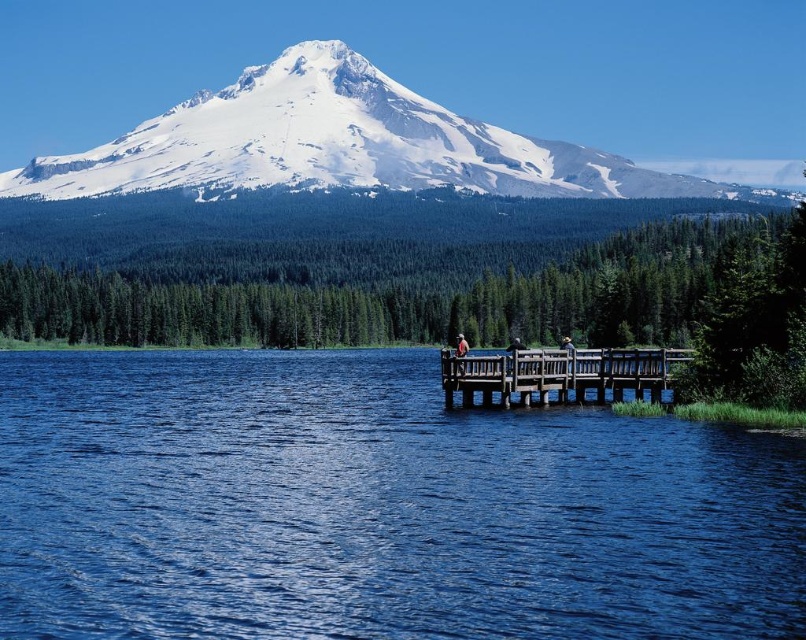
Question: Can you confirm if blue water at center is wider than brown woven hat at center?

Choices:
 (A) yes
 (B) no

Answer: (A)

Question: Among these objects, which one is farthest from the camera?

Choices:
 (A) snowy white mountain at upper center
 (B) wooden dock at center
 (C) brown woven hat at center

Answer: (A)

Question: Does blue water at center have a larger size compared to wooden dock at center?

Choices:
 (A) no
 (B) yes

Answer: (B)

Question: Can you confirm if light brown wooden dock at center is smaller than brown woven hat at center?

Choices:
 (A) no
 (B) yes

Answer: (B)

Question: Which is nearer to the blue water at center?

Choices:
 (A) wooden dock at center
 (B) brown woven hat at center
 (C) light brown wooden dock at center
 (D) snowy white mountain at upper center

Answer: (A)

Question: Which object is farther from the camera taking this photo?

Choices:
 (A) wooden dock at center
 (B) blue water at center

Answer: (A)